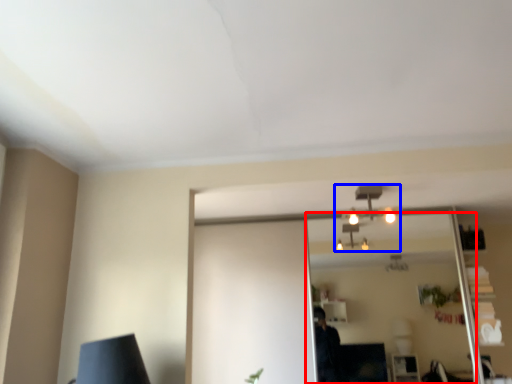
Question: Which object is closer to the camera taking this photo, mirror (highlighted by a red box) or fixture (highlighted by a blue box)?

Choices:
 (A) mirror
 (B) fixture

Answer: (B)